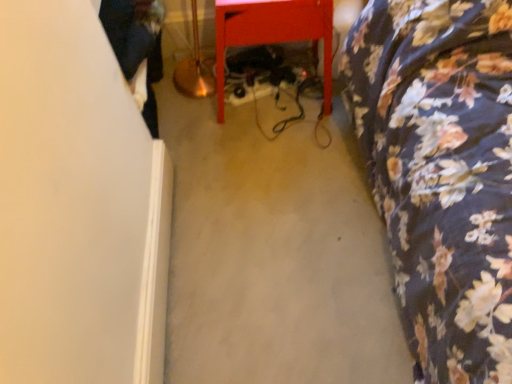
Question: Should I look upward or downward to see dark blue jeans at left?

Choices:
 (A) down
 (B) up

Answer: (B)

Question: Is floral fabric bedspread at right, the 1th furniture when ordered from right to left, surrounding dark blue jeans at left?

Choices:
 (A) no
 (B) yes

Answer: (A)

Question: From the image's perspective, is floral fabric bedspread at right, the 1th furniture when ordered from right to left, on dark blue jeans at left?

Choices:
 (A) yes
 (B) no

Answer: (B)

Question: Is floral fabric bedspread at right, the 1th furniture when ordered from right to left, smaller than dark blue jeans at left?

Choices:
 (A) yes
 (B) no

Answer: (B)

Question: Is floral fabric bedspread at right, placed as the 2th furniture when sorted from left to right, outside dark blue jeans at left?

Choices:
 (A) yes
 (B) no

Answer: (A)

Question: From a real-world perspective, does floral fabric bedspread at right, placed as the 2th furniture when sorted from left to right, stand above dark blue jeans at left?

Choices:
 (A) yes
 (B) no

Answer: (A)

Question: Can you confirm if floral fabric bedspread at right, the 1th furniture when ordered from right to left, is shorter than dark blue jeans at left?

Choices:
 (A) yes
 (B) no

Answer: (B)

Question: Is matte red table at center, acting as the first furniture starting from the left, behind dark blue jeans at left?

Choices:
 (A) yes
 (B) no

Answer: (B)

Question: Could you tell me if matte red table at center, which ranks as the second furniture in right-to-left order, is facing dark blue jeans at left?

Choices:
 (A) yes
 (B) no

Answer: (B)

Question: Is matte red table at center, acting as the first furniture starting from the left, taller than dark blue jeans at left?

Choices:
 (A) yes
 (B) no

Answer: (A)

Question: Can you confirm if matte red table at center, acting as the first furniture starting from the left, is smaller than dark blue jeans at left?

Choices:
 (A) no
 (B) yes

Answer: (A)

Question: From the image's perspective, is matte red table at center, which ranks as the second furniture in right-to-left order, above dark blue jeans at left?

Choices:
 (A) no
 (B) yes

Answer: (A)

Question: Is matte red table at center, acting as the first furniture starting from the left, closer to the viewer compared to dark blue jeans at left?

Choices:
 (A) yes
 (B) no

Answer: (A)

Question: Considering the relative sizes of dark blue jeans at left and matte red table at center, acting as the first furniture starting from the left, in the image provided, is dark blue jeans at left taller than matte red table at center, acting as the first furniture starting from the left,?

Choices:
 (A) no
 (B) yes

Answer: (A)